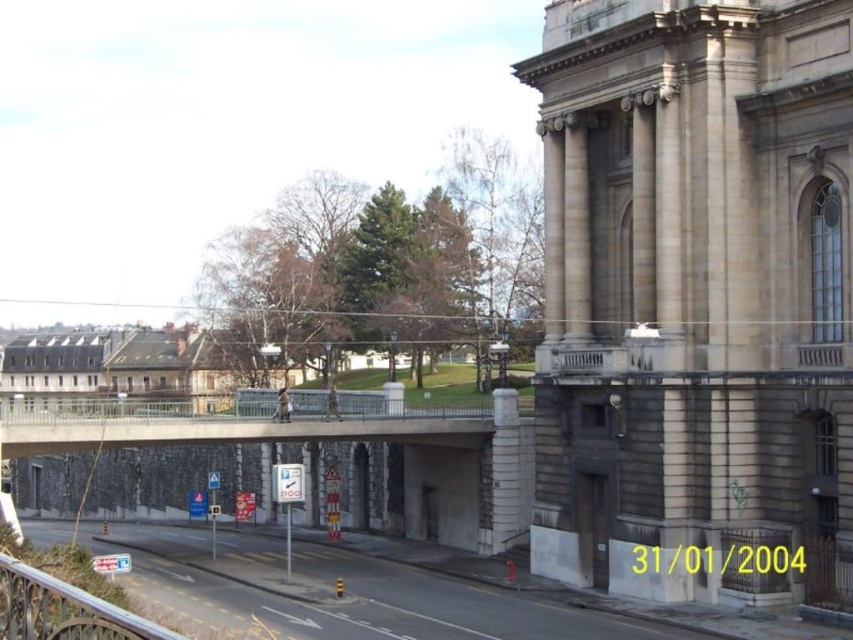
You are a delivery truck driver who needs to cross the metallic gray bridge at center. The truck is 2.5 meters wide. Can you safely pass through the bridge if the metallic silver railing at lower left is only 1.8 meters wide?

The metallic gray bridge at center is wider than the metallic silver railing at lower left, which is 1.8 meters wide. Since the bridge is wider, the truck can safely pass through as its width is 2.5 meters.

You are a photographer planning to capture the metallic gray bridge at center and the metallic silver railing at lower left in a single shot. Given their height difference, which object will appear larger in the photo?

The metallic gray bridge at center will appear larger in the photo because it is much taller than the metallic silver railing at lower left.